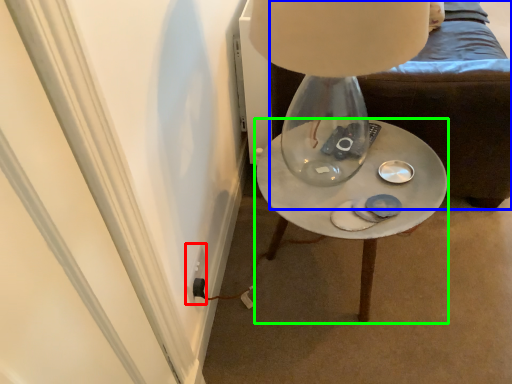
Question: Which object is positioned closest to electric outlet (highlighted by a red box)? Select from furniture (highlighted by a blue box) and table (highlighted by a green box).

Choices:
 (A) furniture
 (B) table

Answer: (B)